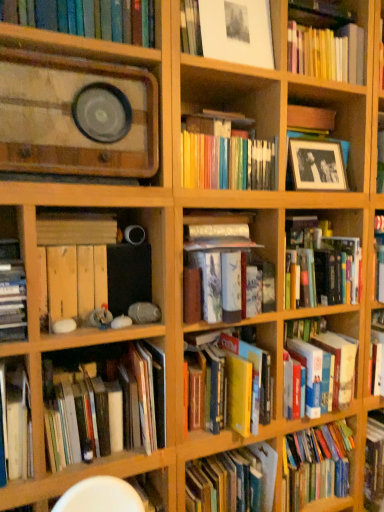
The height and width of the screenshot is (512, 384). What do you see at coordinates (246, 384) in the screenshot?
I see `hardcover book at center, which is the 10th book in top-to-bottom order` at bounding box center [246, 384].

This screenshot has width=384, height=512. Describe the element at coordinates (12, 293) in the screenshot. I see `hardcover book at left, placed as the sixth book when sorted from top to bottom` at that location.

At what (x,y) coordinates should I click in order to perform the action: click on black matte photo frame at upper right, the ninth book ordered from the bottom. Please return your answer as a coordinate pair (x, y). Image resolution: width=384 pixels, height=512 pixels. Looking at the image, I should click on (314, 150).

Find the location of a particular element. matte white framed picture at upper center, the 11th book when ordered from bottom to top is located at coordinates (228, 31).

Which is less distant, (244, 308) or (79, 19)?

The point (79, 19) is closer.

Which object is thinner, hardcover book at center, placed as the eighth book when sorted from top to bottom, or wooden radio at upper left, positioned as the second book in top-to-bottom order?

wooden radio at upper left, positioned as the second book in top-to-bottom order.

Considering the sizes of objects hardcover book at center, placed as the eighth book when sorted from top to bottom, and wooden radio at upper left, marked as the 10th book in a bottom-to-top arrangement, in the image provided, who is bigger, hardcover book at center, placed as the eighth book when sorted from top to bottom, or wooden radio at upper left, marked as the 10th book in a bottom-to-top arrangement,?

Bigger between the two is wooden radio at upper left, marked as the 10th book in a bottom-to-top arrangement.

I want to click on book that is the 5th object located behind the wooden radio at upper left, marked as the 10th book in a bottom-to-top arrangement, so click(x=226, y=265).

Is hardcover book at center, positioned as the 7th book in bottom-to-top order, oriented towards hardcover book at center, placed as the eighth book when sorted from top to bottom?

No.

Starting from the hardcover book at center, placed as the eighth book when sorted from top to bottom, which book is the 4th one behind? Please provide its 2D coordinates.

[(324, 263)]

How far apart are hardcover book at center, which appears as the fifth book when viewed from the top, and hardcover book at center, placed as the eighth book when sorted from top to bottom?

A distance of 10.99 inches exists between hardcover book at center, which appears as the fifth book when viewed from the top, and hardcover book at center, placed as the eighth book when sorted from top to bottom.

How different are the orientations of hardcover book at center, which is counted as the second book, starting from the bottom, and black matte photo frame at upper right, arranged as the 3th book when viewed from the top, in degrees?

The facing directions of hardcover book at center, which is counted as the second book, starting from the bottom, and black matte photo frame at upper right, arranged as the 3th book when viewed from the top, are 0.00175 degrees apart.

Can you confirm if hardcover book at center, which is counted as the second book, starting from the bottom, is taller than black matte photo frame at upper right, the ninth book ordered from the bottom?

Yes, hardcover book at center, which is counted as the second book, starting from the bottom, is taller than black matte photo frame at upper right, the ninth book ordered from the bottom.

Is the depth of hardcover book at center, which is the 10th book in top-to-bottom order, greater than that of black matte photo frame at upper right, arranged as the 3th book when viewed from the top?

No, it is in front of black matte photo frame at upper right, arranged as the 3th book when viewed from the top.

The image size is (384, 512). I want to click on the 4th book to the right of the hardcover book at center, which is counted as the second book, starting from the bottom, counting from the anchor's position, so click(314, 150).

Which is behind, point (296, 226) or point (350, 379)?

The point (296, 226) is behind.

How far apart are hardcover book at center, which appears as the fifth book when viewed from the top, and hardcover book at center-right, which ranks as the third book in bottom-to-top order?

They are 10.19 inches apart.

What's the angular difference between hardcover book at center, positioned as the 7th book in bottom-to-top order, and hardcover book at center-right, which appears as the 9th book when viewed from the top,'s facing directions?

0.000644 degrees separate the facing orientations of hardcover book at center, positioned as the 7th book in bottom-to-top order, and hardcover book at center-right, which appears as the 9th book when viewed from the top.

Is hardcover book at center, positioned as the 7th book in bottom-to-top order, looking in the opposite direction of hardcover book at center-right, which ranks as the third book in bottom-to-top order?

No, hardcover book at center, positioned as the 7th book in bottom-to-top order, is not facing away from hardcover book at center-right, which ranks as the third book in bottom-to-top order.

From their relative heights in the image, would you say wooden crate at center-left, the seventh book viewed from the top, is taller or shorter than hardcover book at left, placed as the sixth book when sorted from top to bottom?

wooden crate at center-left, the seventh book viewed from the top, is shorter than hardcover book at left, placed as the sixth book when sorted from top to bottom.

From a real-world perspective, is wooden crate at center-left, placed as the fifth book when sorted from bottom to top, located higher than hardcover book at left, which is counted as the 6th book, starting from the bottom?

Incorrect, from a real-world perspective, wooden crate at center-left, placed as the fifth book when sorted from bottom to top, is lower than hardcover book at left, which is counted as the 6th book, starting from the bottom.

From the image's perspective, which book is the 1st one above the wooden crate at center-left, placed as the fifth book when sorted from bottom to top? Please provide its 2D coordinates.

[(12, 293)]

Does point (21, 304) appear closer or farther from the camera than point (230, 224)?

Point (21, 304) is closer to the camera than point (230, 224).

Is hardcover book at left, placed as the sixth book when sorted from top to bottom, positioned before hardcover book at center, placed as the eighth book when sorted from top to bottom?

Yes, hardcover book at left, placed as the sixth book when sorted from top to bottom, is closer to the camera.

In terms of width, does hardcover book at left, placed as the sixth book when sorted from top to bottom, look wider or thinner when compared to hardcover book at center, placed as the eighth book when sorted from top to bottom?

hardcover book at left, placed as the sixth book when sorted from top to bottom, is wider than hardcover book at center, placed as the eighth book when sorted from top to bottom.

From the image's perspective, which is below, hardcover book at left, which is counted as the 6th book, starting from the bottom, or hardcover book at center, placed as the eighth book when sorted from top to bottom?

hardcover book at center, placed as the eighth book when sorted from top to bottom, appears lower in the image.

What's the angular difference between matte white framed picture at upper center, the 1th book in the top-to-bottom sequence, and hardcover books at lower left, acting as the 1th book starting from the bottom,'s facing directions?

0.000397 degrees.

Which of these two, matte white framed picture at upper center, the 11th book when ordered from bottom to top, or hardcover books at lower left, acting as the 1th book starting from the bottom, stands taller?

With more height is hardcover books at lower left, acting as the 1th book starting from the bottom.

Considering the sizes of matte white framed picture at upper center, the 1th book in the top-to-bottom sequence, and hardcover books at lower left, acting as the 1th book starting from the bottom, in the image, is matte white framed picture at upper center, the 1th book in the top-to-bottom sequence, wider or thinner than hardcover books at lower left, acting as the 1th book starting from the bottom,?

matte white framed picture at upper center, the 1th book in the top-to-bottom sequence, is thinner than hardcover books at lower left, acting as the 1th book starting from the bottom.

At what (x,y) coordinates should I click in order to perform the action: click on the 5th book behind the wooden radio at upper left, positioned as the second book in top-to-bottom order, starting your count from the anchor. Please return your answer as a coordinate pair (x, y). Looking at the image, I should click on (226, 265).

At what (x,y) coordinates should I click in order to perform the action: click on book that is the 3rd one when counting upward from the hardcover book at center, the fourth book from the bottom (from the image's perspective). Please return your answer as a coordinate pair (x, y). The width and height of the screenshot is (384, 512). Looking at the image, I should click on (324, 263).

Looking at the image, which one is located closer to hardcover book at center-right, which appears as the 9th book when viewed from the top, wooden crate at center-left, the seventh book viewed from the top, or wooden radio at upper left, marked as the 10th book in a bottom-to-top arrangement?

wooden crate at center-left, the seventh book viewed from the top, is positioned closer to the anchor hardcover book at center-right, which appears as the 9th book when viewed from the top.

Looking at this image, which object lies nearer to the anchor point wooden crate at center-left, placed as the fifth book when sorted from bottom to top, wooden crate at lower left, the fourth book when ordered from top to bottom, or hardcover book at center-right, which ranks as the third book in bottom-to-top order?

wooden crate at lower left, the fourth book when ordered from top to bottom, is positioned closer to the anchor wooden crate at center-left, placed as the fifth book when sorted from bottom to top.

Which object lies nearer to the anchor point wooden crate at center-left, placed as the fifth book when sorted from bottom to top, hardcover book at center, the fourth book from the bottom, or hardcover book at center, which appears as the fifth book when viewed from the top?

Among the two, hardcover book at center, the fourth book from the bottom, is located nearer to wooden crate at center-left, placed as the fifth book when sorted from bottom to top.

Based on their spatial positions, is wooden radio at upper left, positioned as the second book in top-to-bottom order, or hardcover book at left, placed as the sixth book when sorted from top to bottom, closer to hardcover book at center, positioned as the 7th book in bottom-to-top order?

wooden radio at upper left, positioned as the second book in top-to-bottom order, is positioned closer to the anchor hardcover book at center, positioned as the 7th book in bottom-to-top order.

Looking at the image, which one is located closer to hardcover book at center-right, which ranks as the third book in bottom-to-top order, hardcover book at center, which is counted as the second book, starting from the bottom, or hardcover book at center, placed as the eighth book when sorted from top to bottom?

The object closer to hardcover book at center-right, which ranks as the third book in bottom-to-top order, is hardcover book at center, which is counted as the second book, starting from the bottom.

Estimate the real-world distances between objects in this image. Which object is further from wooden radio at upper left, positioned as the second book in top-to-bottom order, hardcover book at left, which is counted as the 6th book, starting from the bottom, or hardcover book at center, placed as the eighth book when sorted from top to bottom?

hardcover book at center, placed as the eighth book when sorted from top to bottom.

When comparing their distances from black matte photo frame at upper right, arranged as the 3th book when viewed from the top, does wooden crate at lower left, the fourth book when ordered from top to bottom, or hardcover book at center, which appears as the fifth book when viewed from the top, seem further?

wooden crate at lower left, the fourth book when ordered from top to bottom.

When comparing their distances from wooden crate at center-left, the seventh book viewed from the top, does hardcover book at center, positioned as the 7th book in bottom-to-top order, or wooden crate at lower left, the fourth book when ordered from top to bottom, seem closer?

The object closer to wooden crate at center-left, the seventh book viewed from the top, is wooden crate at lower left, the fourth book when ordered from top to bottom.

Find the location of a particular element. book between wooden crate at center-left, placed as the fifth book when sorted from bottom to top, and hardcover book at center, placed as the eighth book when sorted from top to bottom is located at coordinates (107, 400).

Where is `book between hardcover books at lower left, acting as the 1th book starting from the bottom, and hardcover book at center, which is counted as the second book, starting from the bottom, in the horizontal direction`? Image resolution: width=384 pixels, height=512 pixels. book between hardcover books at lower left, acting as the 1th book starting from the bottom, and hardcover book at center, which is counted as the second book, starting from the bottom, in the horizontal direction is located at coordinates (226, 265).